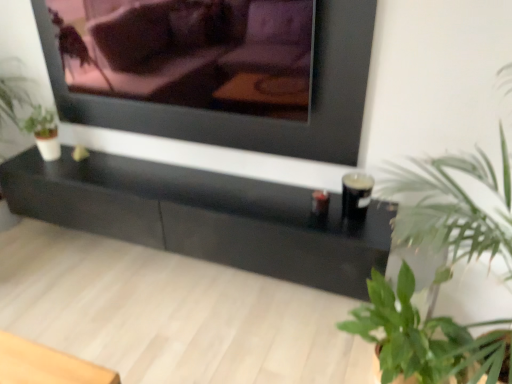
Question: Is black glossy table at center positioned with its back to green leafy plant at lower right, which is the 2th houseplant in top-to-bottom order?

Choices:
 (A) no
 (B) yes

Answer: (A)

Question: Does black glossy table at center have a lesser width compared to green leafy plant at lower right, which is the 2th houseplant in top-to-bottom order?

Choices:
 (A) yes
 (B) no

Answer: (A)

Question: Considering the relative sizes of black glossy table at center and green leafy plant at lower right, which is the 2th houseplant in top-to-bottom order, in the image provided, is black glossy table at center bigger than green leafy plant at lower right, which is the 2th houseplant in top-to-bottom order,?

Choices:
 (A) no
 (B) yes

Answer: (B)

Question: Considering the relative positions of black glossy table at center and green leafy plant at lower right, positioned as the 1th houseplant in bottom-to-top order, in the image provided, is black glossy table at center to the right of green leafy plant at lower right, positioned as the 1th houseplant in bottom-to-top order, from the viewer's perspective?

Choices:
 (A) yes
 (B) no

Answer: (B)

Question: Is black glossy table at center oriented towards green leafy plant at lower right, positioned as the 1th houseplant in bottom-to-top order?

Choices:
 (A) yes
 (B) no

Answer: (B)

Question: From a real-world perspective, is black glossy table at center physically below green leafy plant at lower right, which is the 2th houseplant in top-to-bottom order?

Choices:
 (A) yes
 (B) no

Answer: (B)

Question: Is matte black frame at upper center not inside matte black couch at upper center?

Choices:
 (A) yes
 (B) no

Answer: (A)

Question: Is matte black frame at upper center oriented away from matte black couch at upper center?

Choices:
 (A) yes
 (B) no

Answer: (A)

Question: Considering the relative sizes of matte black frame at upper center and matte black couch at upper center in the image provided, is matte black frame at upper center smaller than matte black couch at upper center?

Choices:
 (A) no
 (B) yes

Answer: (B)

Question: Could you tell me if matte black frame at upper center is turned towards matte black couch at upper center?

Choices:
 (A) no
 (B) yes

Answer: (B)

Question: Does matte black frame at upper center appear on the left side of matte black couch at upper center?

Choices:
 (A) no
 (B) yes

Answer: (A)

Question: Considering the relative sizes of matte black frame at upper center and matte black couch at upper center in the image provided, is matte black frame at upper center thinner than matte black couch at upper center?

Choices:
 (A) no
 (B) yes

Answer: (B)

Question: Is the position of matte black couch at upper center more distant than that of matte black frame at upper center?

Choices:
 (A) no
 (B) yes

Answer: (A)